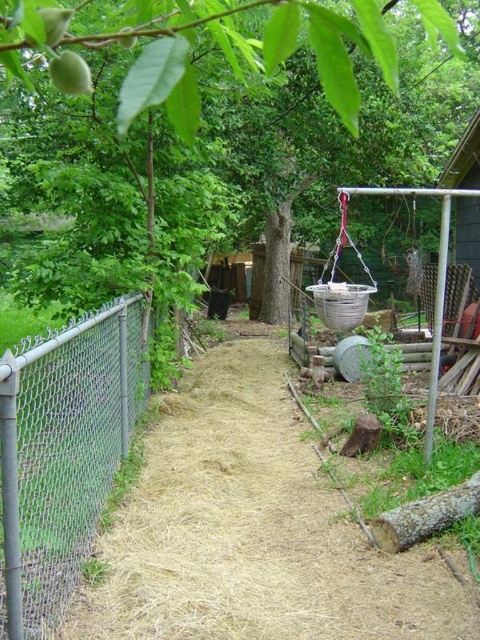
You are standing in the backyard and want to take a photo of the green leafy tree at upper center. If your camera has a maximum focus range of 60 centimeters, will you need to move closer or further away to capture it clearly?

The green leafy tree at upper center is 66.69 centimeters away from the camera, which exceeds the maximum focus range of 60 centimeters. You need to move closer to reduce the distance so the camera can focus properly.